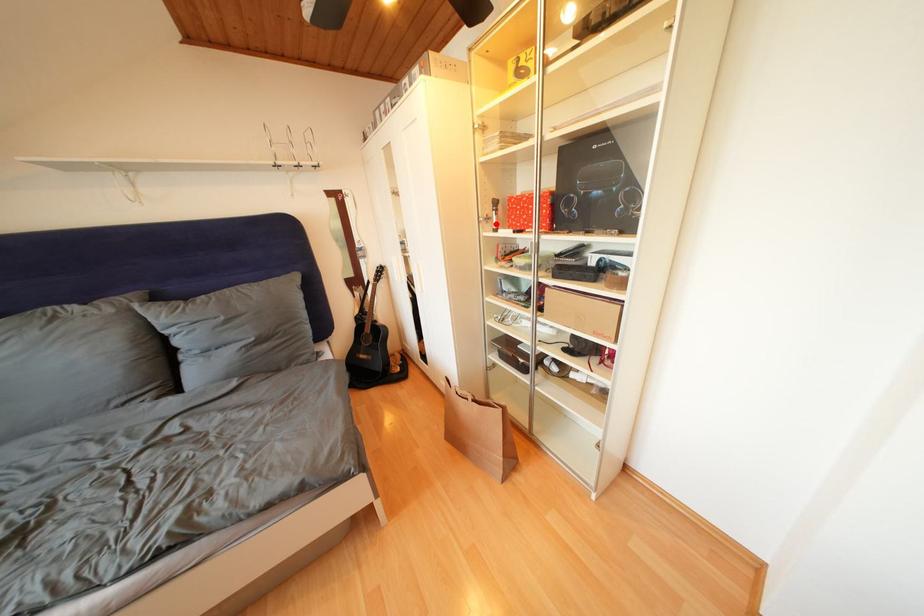
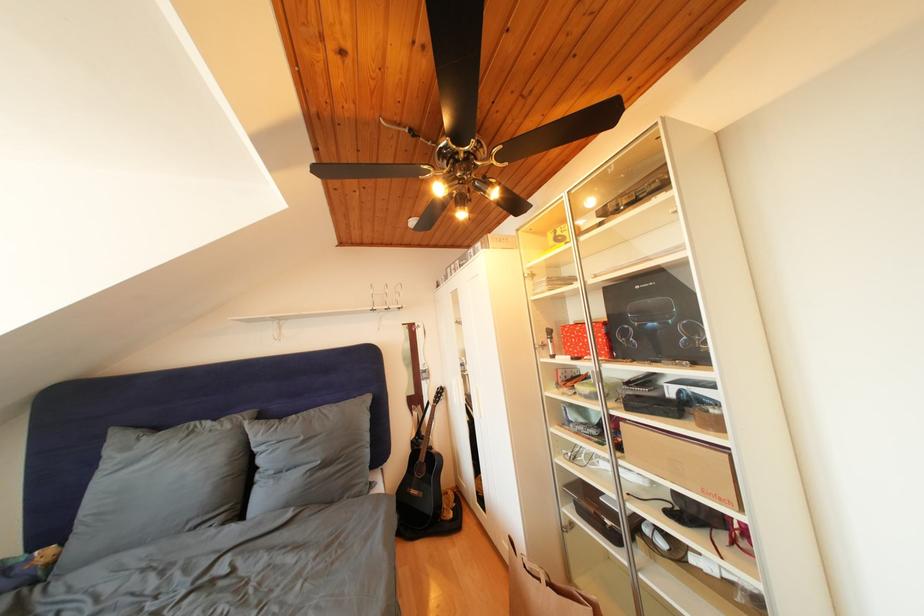
The point at the highlighted location is marked in the first image. Where is the corresponding point in the second image?

(552, 351)